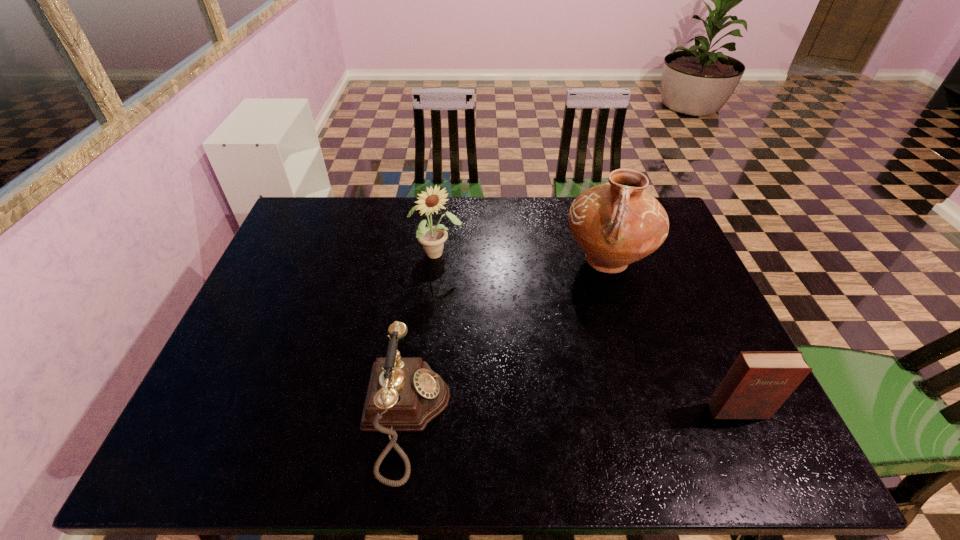
I want to click on telephone, so click(x=404, y=394).

At what (x,y) coordinates should I click in order to perform the action: click on diary. Please return your answer as a coordinate pair (x, y). Image resolution: width=960 pixels, height=540 pixels. Looking at the image, I should click on (759, 382).

Locate an element on the screen. sunflower is located at coordinates click(432, 238).

Find the location of a particular element. The height and width of the screenshot is (540, 960). pottery is located at coordinates pos(617,223).

What are the coordinates of `free point located 0.310m on the dial of the telephone` in the screenshot? It's located at (590, 416).

At what (x,y) coordinates should I click in order to perform the action: click on vacant region located on the front-facing side of the sunflower. Please return your answer as a coordinate pair (x, y). Looking at the image, I should click on (491, 331).

What are the coordinates of `free space located 0.240m on the front-facing side of the sunflower` in the screenshot? It's located at (482, 318).

At what (x,y) coordinates should I click in order to perform the action: click on free space located 0.170m on the front-facing side of the sunflower. Please return your answer as a coordinate pair (x, y). The height and width of the screenshot is (540, 960). Looking at the image, I should click on (470, 300).

Identify the location of vacant space located on the side of the pottery with the handle. (574, 347).

Identify the location of vacant space located on the side of the pottery with the handle. The width and height of the screenshot is (960, 540). (564, 371).